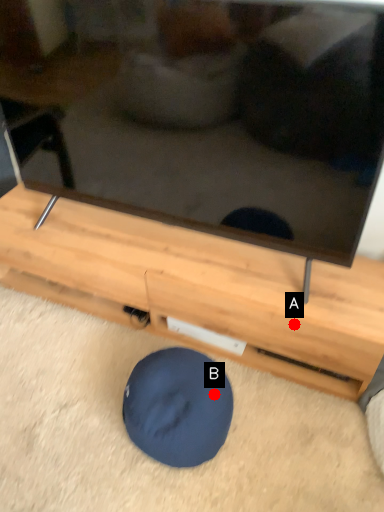
Question: Two points are circled on the image, labeled by A and B beside each circle. Which point appears farthest from the camera in this image?

Choices:
 (A) A is further
 (B) B is further

Answer: (A)